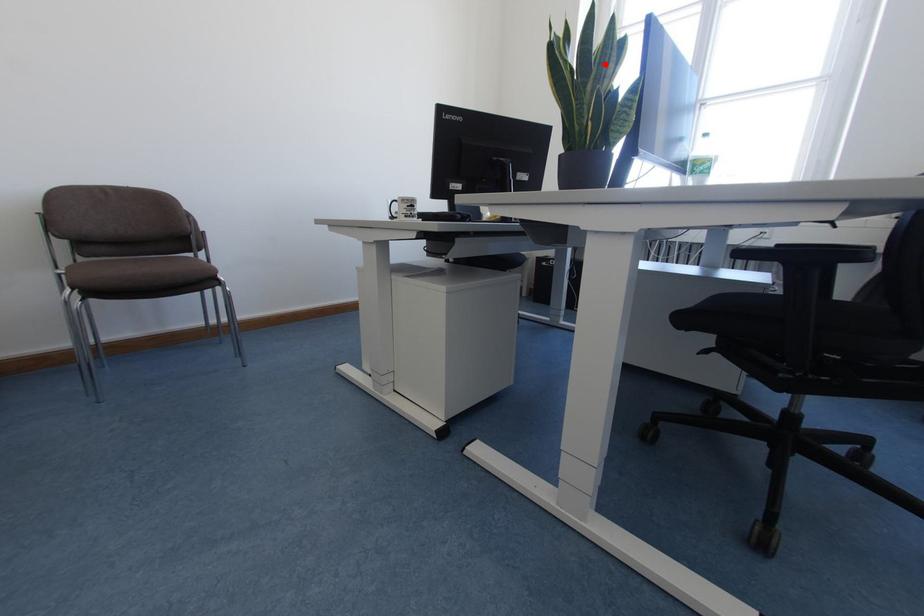
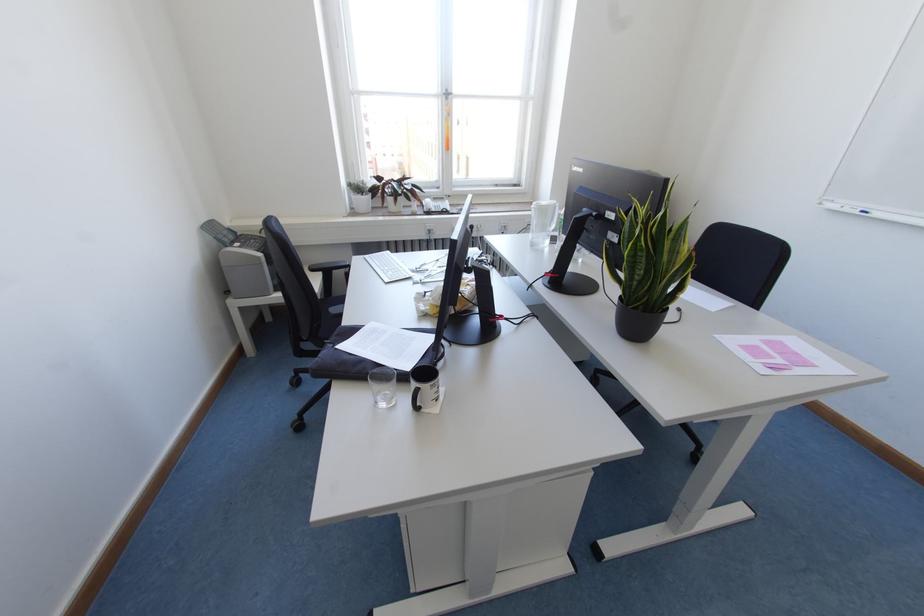
Find the pixel in the second image that matches the highlighted location in the first image.

(677, 243)